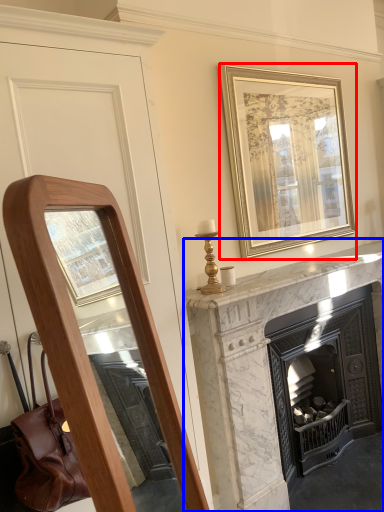
Question: Which of the following is the farthest to the observer, picture frame (highlighted by a red box) or fireplace (highlighted by a blue box)?

Choices:
 (A) picture frame
 (B) fireplace

Answer: (A)